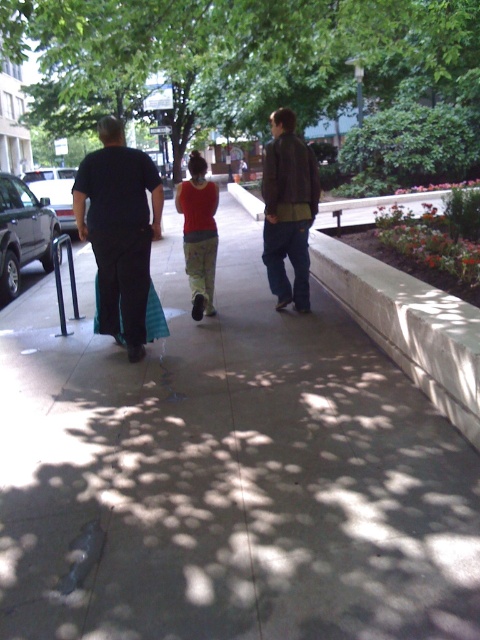
You are standing on the sidewalk and want to take a photo of the three people walking away from you. To ensure the green leafy tree at upper center is not blocking the view, where should you position yourself relative to the tree?

To avoid the green leafy tree at upper center blocking the view, you should position yourself to the left or right of the tree since its 2D location is at point (240,56), meaning it is positioned slightly to the left side of the image. By moving to either side of the tree, you can frame the three people without obstruction.